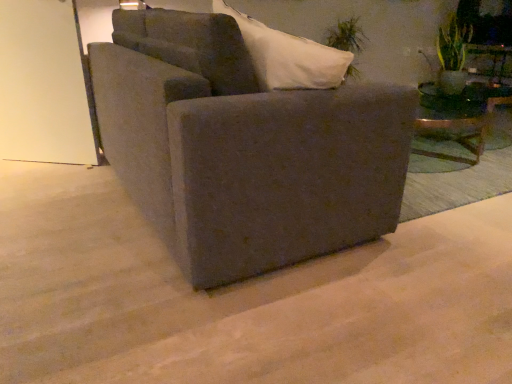
Question: Is the position of transparent glass door at upper left less distant than that of green leafy plant at upper right, the 1th plant viewed from the front?

Choices:
 (A) yes
 (B) no

Answer: (A)

Question: Is green leafy plant at upper right, acting as the 1th plant starting from the right, completely or partially inside transparent glass door at upper left?

Choices:
 (A) yes
 (B) no

Answer: (B)

Question: From the image's perspective, is transparent glass door at upper left located above green leafy plant at upper right, the 1th plant viewed from the front?

Choices:
 (A) no
 (B) yes

Answer: (A)

Question: Considering the relative sizes of transparent glass door at upper left and green leafy plant at upper right, the 1th plant viewed from the front, in the image provided, is transparent glass door at upper left thinner than green leafy plant at upper right, the 1th plant viewed from the front,?

Choices:
 (A) no
 (B) yes

Answer: (B)

Question: Is transparent glass door at upper left at the left side of green leafy plant at upper right, placed as the 2th plant when sorted from back to front?

Choices:
 (A) no
 (B) yes

Answer: (B)

Question: Considering the relative sizes of transparent glass door at upper left and green leafy plant at upper right, placed as the 2th plant when sorted from back to front, in the image provided, is transparent glass door at upper left shorter than green leafy plant at upper right, placed as the 2th plant when sorted from back to front,?

Choices:
 (A) yes
 (B) no

Answer: (B)

Question: Is green leafy plant at upper right, acting as the 1th plant starting from the right, outside green leafy plant at upper right, positioned as the first plant in back-to-front order?

Choices:
 (A) yes
 (B) no

Answer: (A)

Question: Are green leafy plant at upper right, which is counted as the second plant, starting from the left, and green leafy plant at upper right, which ranks as the second plant in right-to-left order, far apart?

Choices:
 (A) yes
 (B) no

Answer: (A)

Question: From a real-world perspective, is green leafy plant at upper right, placed as the 2th plant when sorted from back to front, physically above green leafy plant at upper right, placed as the 2th plant when sorted from front to back?

Choices:
 (A) no
 (B) yes

Answer: (B)

Question: Is green leafy plant at upper right, placed as the 2th plant when sorted from back to front, aimed at green leafy plant at upper right, placed as the 2th plant when sorted from front to back?

Choices:
 (A) no
 (B) yes

Answer: (A)

Question: Can you confirm if green leafy plant at upper right, placed as the 2th plant when sorted from back to front, is bigger than green leafy plant at upper right, the 1th plant when ordered from left to right?

Choices:
 (A) no
 (B) yes

Answer: (A)

Question: From a real-world perspective, is green leafy plant at upper right, the 1th plant viewed from the front, under green leafy plant at upper right, placed as the 2th plant when sorted from front to back?

Choices:
 (A) yes
 (B) no

Answer: (B)

Question: Is green leafy plant at upper right, which ranks as the second plant in right-to-left order, closer to camera compared to matte gray couch at center?

Choices:
 (A) no
 (B) yes

Answer: (A)